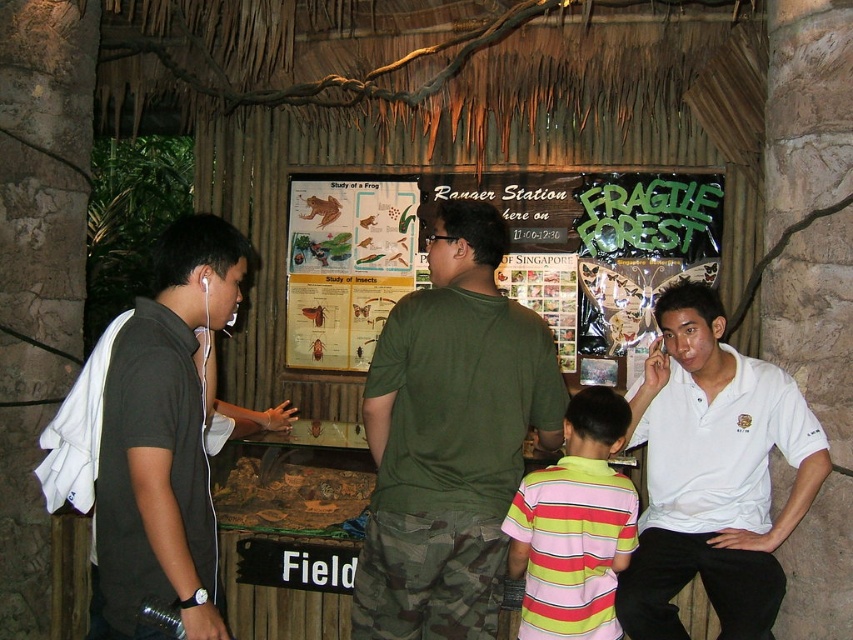
You are a photographer at the educational exhibit and want to capture a photo of both the black matte shirt at left and the striped cotton shirt at center. Since you can only focus on one person at a time, which person should you focus on to ensure both are in the frame?

You should focus on the striped cotton shirt at center because the black matte shirt at left is positioned to its left side, so both will be in the frame when focusing on the center person.